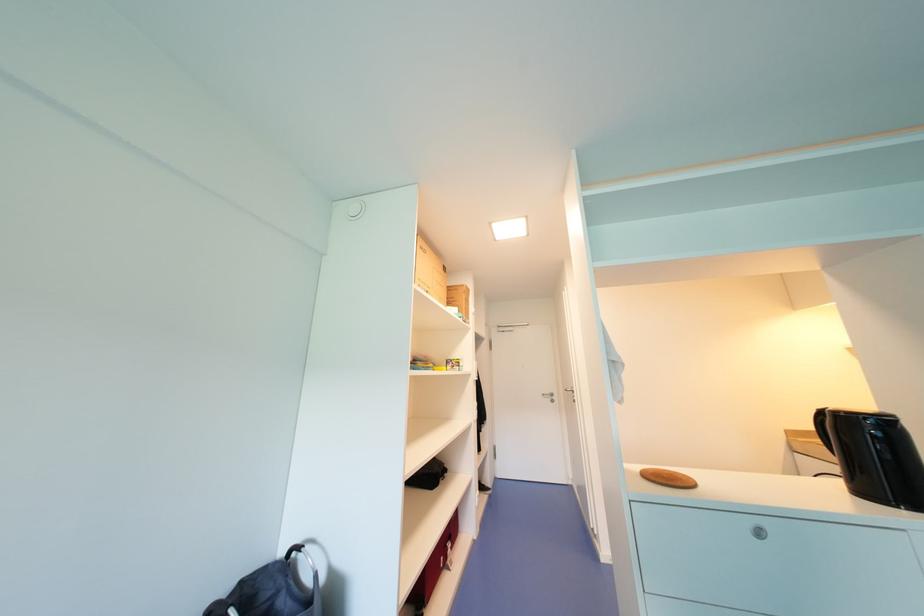
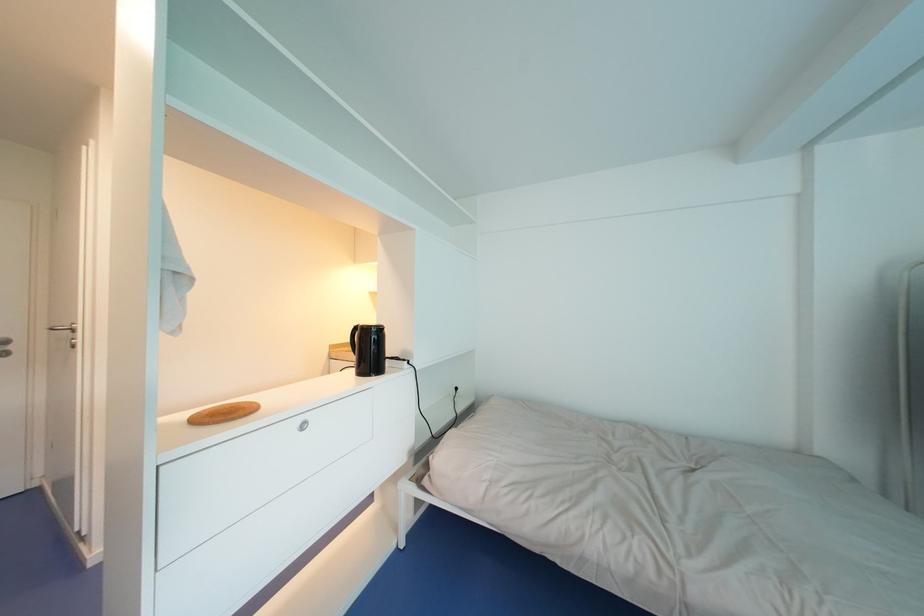
Question: How did the camera likely rotate?

Choices:
 (A) Left
 (B) Right
 (C) Up
 (D) Down

Answer: (B)